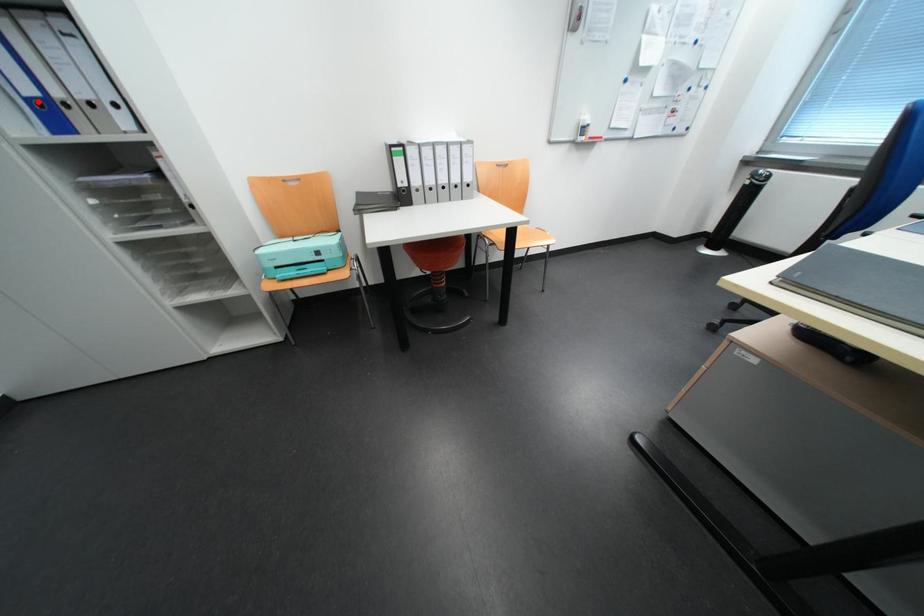
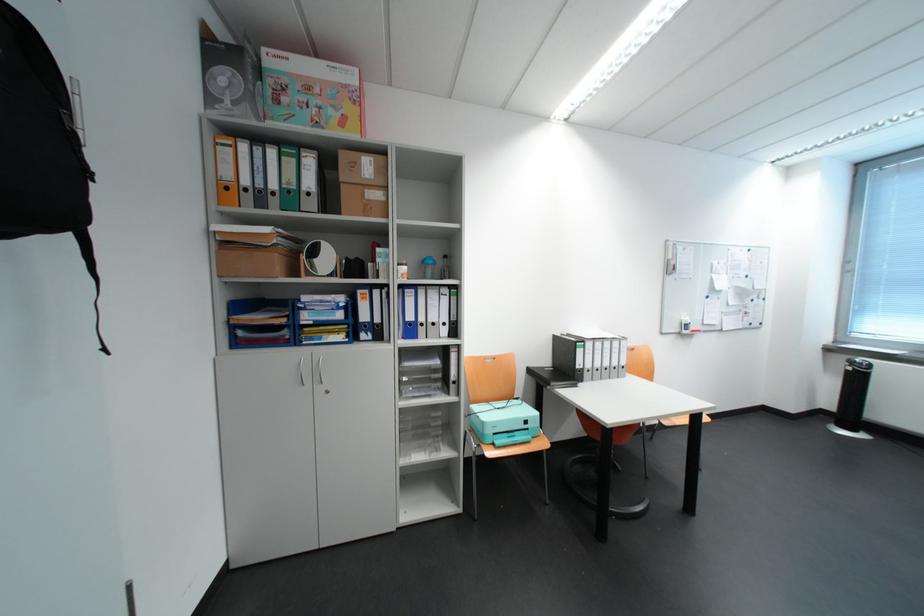
Question: I am providing you with two images of the same scene from different viewpoints. Image1 has a red point marked. In image2, the corresponding 3D location appears at what relative position? Reply with the corresponding letter.

Choices:
 (A) Closer
 (B) Farther

Answer: (A)